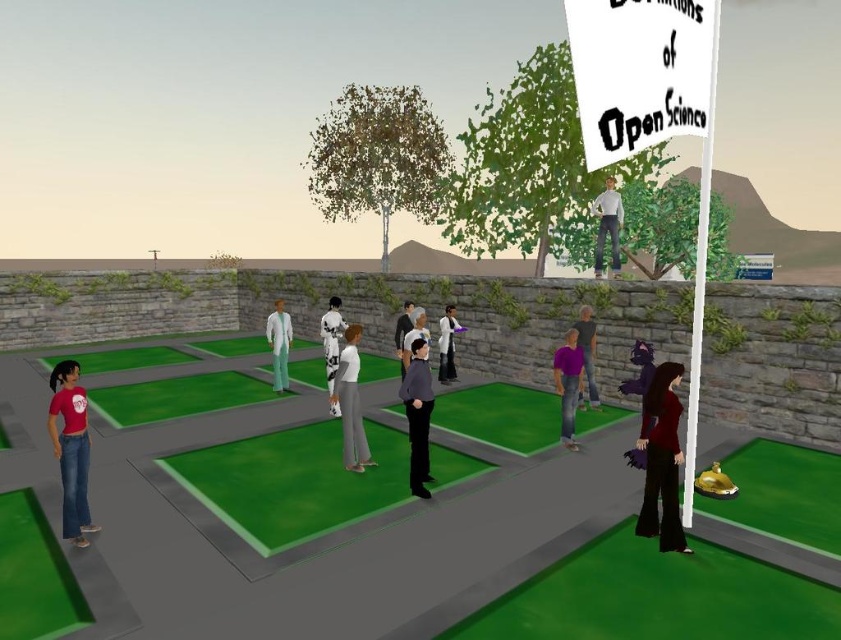
You are an avatar in the plaza and want to move from your current position to a new location. You have two options marked as point 1 at coordinates point (56, 388) and point 2 at coordinates point (419, 476). Which point is closer to you?

Point (56, 388) is closer to the camera than point (419, 476), so you should choose point (56, 388) as it is nearer to your current position.